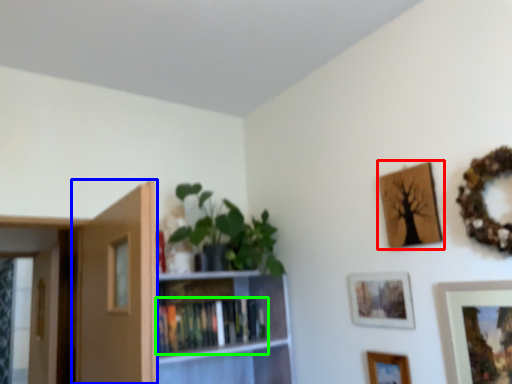
Question: Based on their relative distances, which object is farther from picture frame (highlighted by a red box)? Choose from door (highlighted by a blue box) and book (highlighted by a green box).

Choices:
 (A) door
 (B) book

Answer: (A)